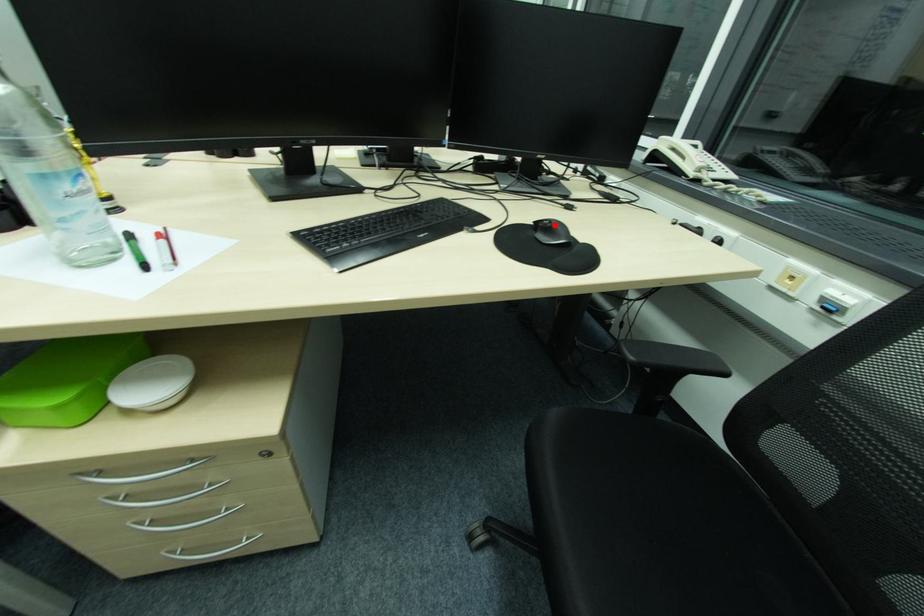
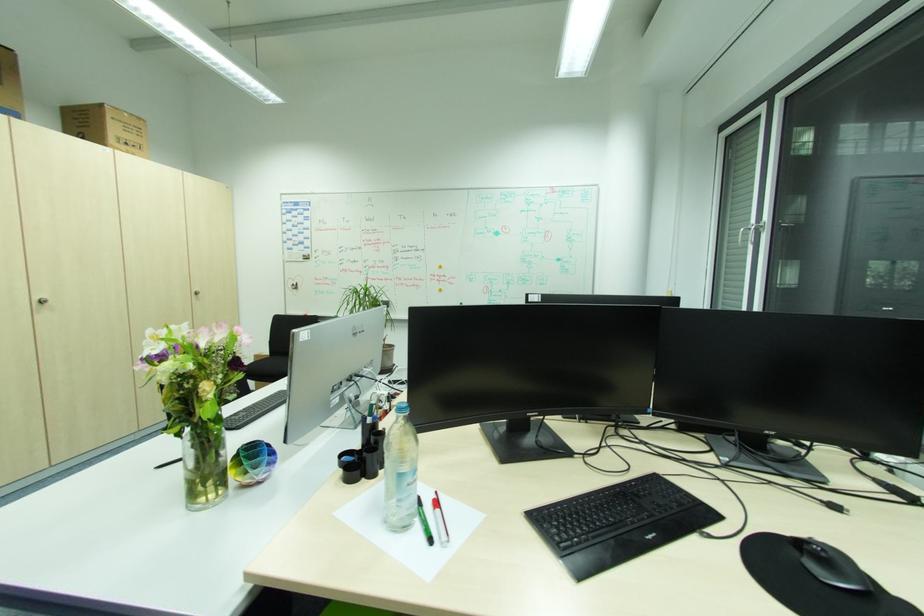
Find the pixel in the second image that matches the highlighted location in the first image.

(829, 554)